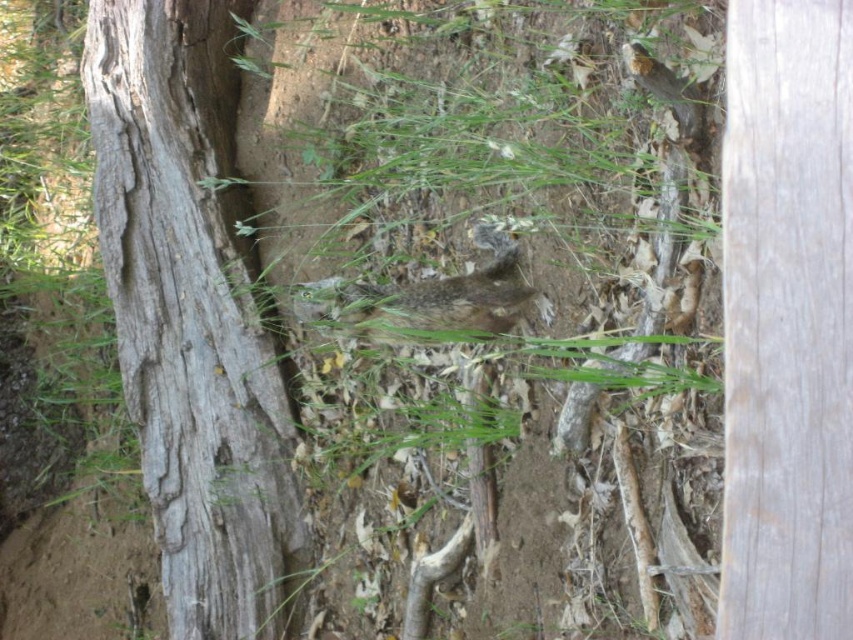
You are standing in a forest and want to locate the gray rough bark tree trunk at left. According to the coordinates provided, where would you find it in the image?

The gray rough bark tree trunk at left is located at the 2D coordinates point (193, 314) in the image.

You are a photographer trying to capture a clear shot of the fuzzy brown squirrel at center. However, the weathered wood at right is blocking your view. Can you move to the left to get a better angle? Explain why or why not based on their positions.

The weathered wood at right is closer to the viewer than the fuzzy brown squirrel at center. Moving to the left might not help because the wood is still between you and the squirrel. To get a clear shot, you would need to position yourself where the wood is no longer blocking the view, possibly by moving around it or adjusting your angle so the wood is no longer in front of the squirrel.